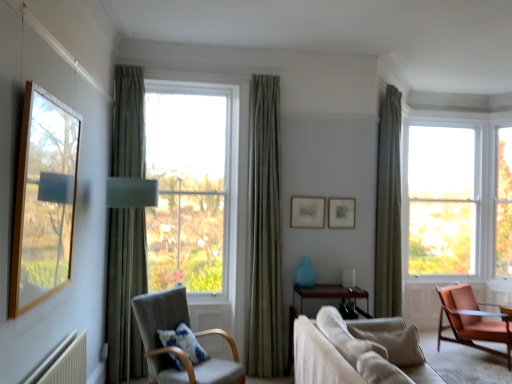
Question: Is green fabric curtain at right, which is the first curtain in back-to-front order, oriented towards light gray fabric chair at center-left, which appears as the 1th chair when viewed from the left?

Choices:
 (A) yes
 (B) no

Answer: (B)

Question: From the image's perspective, would you say green fabric curtain at right, which is the third curtain in left-to-right order, is positioned over light gray fabric chair at center-left, which appears as the 1th chair when viewed from the left?

Choices:
 (A) yes
 (B) no

Answer: (A)

Question: Considering the relative sizes of green fabric curtain at right, placed as the first curtain when sorted from right to left, and light gray fabric chair at center-left, which appears as the 1th chair when viewed from the left, in the image provided, is green fabric curtain at right, placed as the first curtain when sorted from right to left, bigger than light gray fabric chair at center-left, which appears as the 1th chair when viewed from the left,?

Choices:
 (A) no
 (B) yes

Answer: (B)

Question: Does green fabric curtain at right, placed as the first curtain when sorted from right to left, have a smaller size compared to light gray fabric chair at center-left, marked as the 2th chair in a back-to-front arrangement?

Choices:
 (A) yes
 (B) no

Answer: (B)

Question: From the image's perspective, is green fabric curtain at right, arranged as the third curtain when viewed from the front, beneath light gray fabric chair at center-left, which appears as the 2th chair when viewed from the right?

Choices:
 (A) yes
 (B) no

Answer: (B)

Question: Considering the positions of clear glass window at right, the first window from the right, and beige fabric couch at lower right in the image, is clear glass window at right, the first window from the right, wider or thinner than beige fabric couch at lower right?

Choices:
 (A) wide
 (B) thin

Answer: (B)

Question: Is point (497, 248) positioned closer to the camera than point (324, 380)?

Choices:
 (A) farther
 (B) closer

Answer: (A)

Question: Is clear glass window at right, which is counted as the second window, starting from the back, in front of or behind beige fabric couch at lower right in the image?

Choices:
 (A) behind
 (B) front

Answer: (A)

Question: From a real-world perspective, is clear glass window at right, which is counted as the second window, starting from the back, above or below beige fabric couch at lower right?

Choices:
 (A) below
 (B) above

Answer: (B)

Question: From a real-world perspective, is beige fabric couch at lower right positioned above or below teal matte vase at center?

Choices:
 (A) below
 (B) above

Answer: (A)

Question: Considering the positions of beige fabric couch at lower right and teal matte vase at center in the image, is beige fabric couch at lower right taller or shorter than teal matte vase at center?

Choices:
 (A) short
 (B) tall

Answer: (B)

Question: Considering the relative positions of beige fabric couch at lower right and teal matte vase at center in the image provided, is beige fabric couch at lower right to the left or to the right of teal matte vase at center?

Choices:
 (A) left
 (B) right

Answer: (B)

Question: Considering the positions of beige fabric couch at lower right and teal matte vase at center in the image, is beige fabric couch at lower right bigger or smaller than teal matte vase at center?

Choices:
 (A) small
 (B) big

Answer: (B)

Question: Would you say light gray fabric chair at center-left, which appears as the 2th chair when viewed from the right, is inside or outside teal matte vase at center?

Choices:
 (A) inside
 (B) outside

Answer: (B)

Question: From the image's perspective, is light gray fabric chair at center-left, marked as the 2th chair in a back-to-front arrangement, above or below teal matte vase at center?

Choices:
 (A) below
 (B) above

Answer: (A)